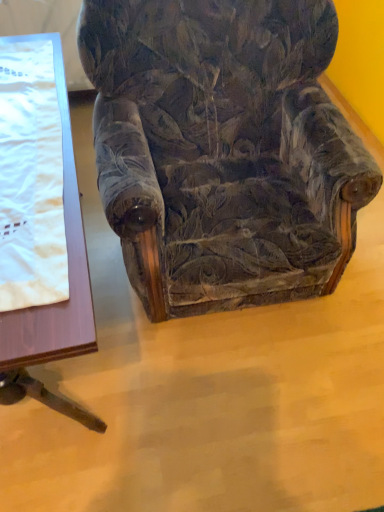
Question: From the image's perspective, is velvet floral-patterned armchair at center below wooden table at left?

Choices:
 (A) yes
 (B) no

Answer: (B)

Question: From a real-world perspective, does velvet floral-patterned armchair at center sit lower than wooden table at left?

Choices:
 (A) no
 (B) yes

Answer: (A)

Question: Is velvet floral-patterned armchair at center bigger than wooden table at left?

Choices:
 (A) no
 (B) yes

Answer: (B)

Question: Can you confirm if velvet floral-patterned armchair at center is taller than wooden table at left?

Choices:
 (A) no
 (B) yes

Answer: (B)

Question: Does velvet floral-patterned armchair at center have a lesser width compared to wooden table at left?

Choices:
 (A) no
 (B) yes

Answer: (B)

Question: Is wooden table at left inside velvet floral-patterned armchair at center?

Choices:
 (A) yes
 (B) no

Answer: (B)

Question: Can you confirm if white satin blanket at left is shorter than wooden table at left?

Choices:
 (A) no
 (B) yes

Answer: (B)

Question: From the image's perspective, does white satin blanket at left appear higher than wooden table at left?

Choices:
 (A) no
 (B) yes

Answer: (B)

Question: Is white satin blanket at left wider than wooden table at left?

Choices:
 (A) no
 (B) yes

Answer: (A)

Question: From a real-world perspective, is white satin blanket at left beneath wooden table at left?

Choices:
 (A) yes
 (B) no

Answer: (B)

Question: Does white satin blanket at left appear on the right side of wooden table at left?

Choices:
 (A) yes
 (B) no

Answer: (A)

Question: Does white satin blanket at left have a greater height compared to wooden table at left?

Choices:
 (A) no
 (B) yes

Answer: (A)

Question: Is wooden table at left shorter than white satin blanket at left?

Choices:
 (A) no
 (B) yes

Answer: (A)